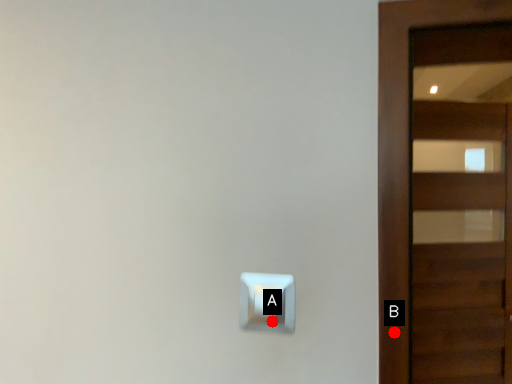
Question: Two points are circled on the image, labeled by A and B beside each circle. Which point is closer to the camera?

Choices:
 (A) A is closer
 (B) B is closer

Answer: (B)